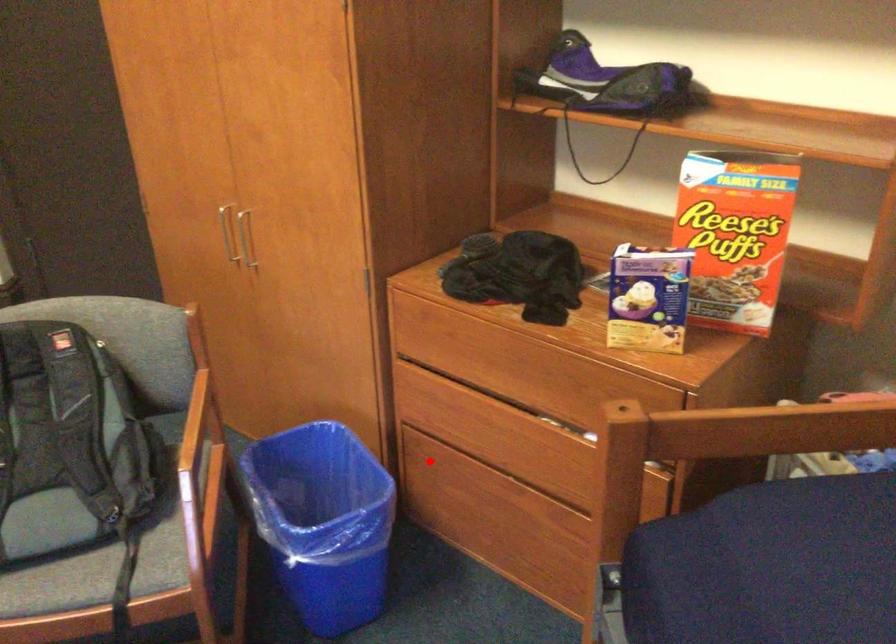
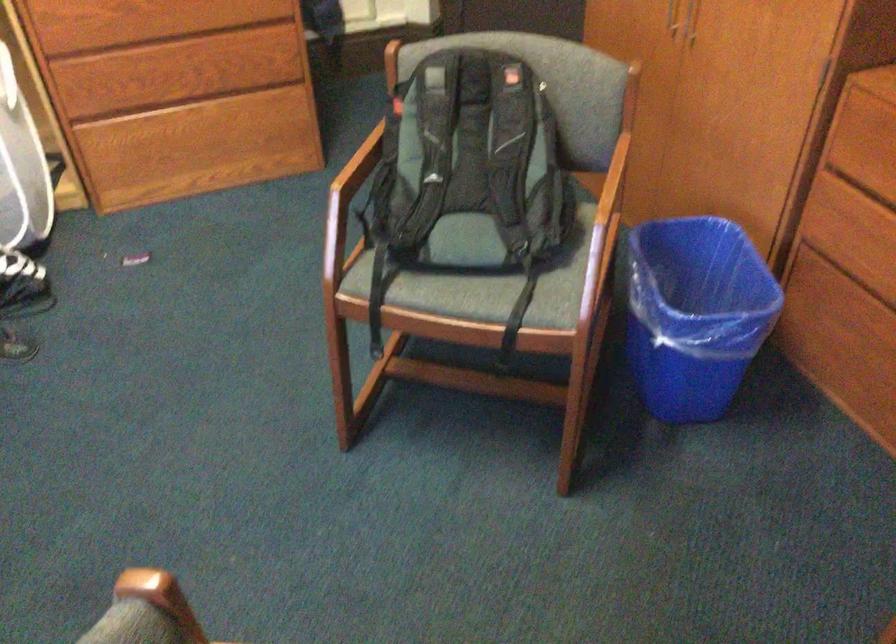
Locate, in the second image, the point that corresponds to the highlighted location in the first image.

(828, 285)